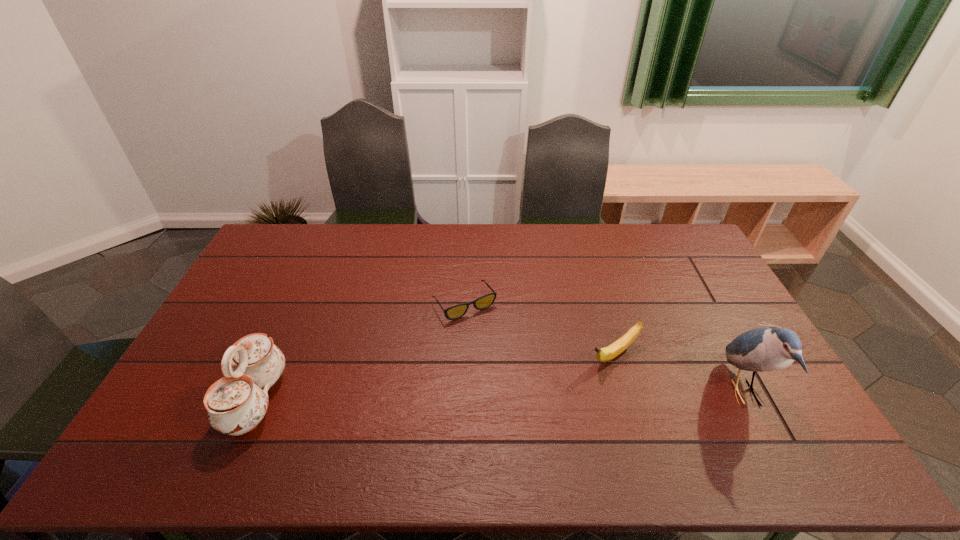
Identify the location of the leftmost object. (236, 403).

Where is `the third shortest object`? the third shortest object is located at coordinates (236, 403).

What are the coordinates of `bird` in the screenshot? It's located at (767, 349).

The width and height of the screenshot is (960, 540). Find the location of `the rightmost object`. the rightmost object is located at coordinates (767, 349).

Identify the location of the third object from left to right. (608, 353).

Where is `the third tallest object`? the third tallest object is located at coordinates (608, 353).

Identify the location of the farthest object. The width and height of the screenshot is (960, 540). (457, 311).

This screenshot has width=960, height=540. I want to click on the second object from left to right, so click(x=457, y=311).

Where is `vacant region located 0.170m by the handle of the second tallest object`? This screenshot has height=540, width=960. vacant region located 0.170m by the handle of the second tallest object is located at coordinates (346, 400).

At what (x,y) coordinates should I click in order to perform the action: click on vacant space located 0.230m at the stem of the third tallest object. Please return your answer as a coordinate pair (x, y). The width and height of the screenshot is (960, 540). Looking at the image, I should click on (534, 407).